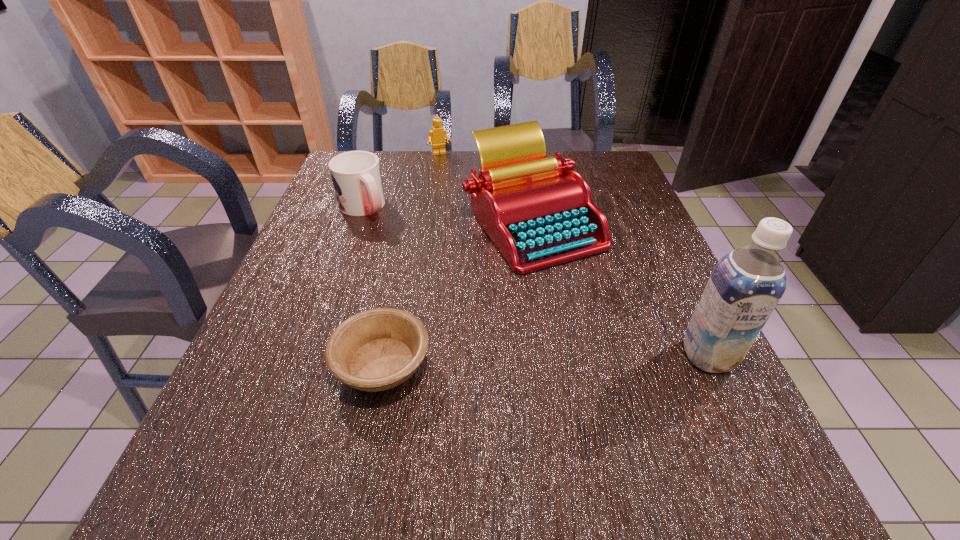
Find the location of a particular element. object situated at the near edge is located at coordinates (378, 349).

Locate an element on the screen. The height and width of the screenshot is (540, 960). object that is positioned at the left edge is located at coordinates [356, 175].

Where is `soya milk that is at the right edge`? soya milk that is at the right edge is located at coordinates (746, 284).

Locate an element on the screen. typewriter located in the right edge section of the desktop is located at coordinates (538, 212).

The width and height of the screenshot is (960, 540). Find the location of `object at the far right corner`. object at the far right corner is located at coordinates pyautogui.click(x=538, y=212).

At what (x,y) coordinates should I click in order to perform the action: click on vacant space at the far edge. Please return your answer as a coordinate pair (x, y). This screenshot has height=540, width=960. Looking at the image, I should click on (435, 163).

You are a GUI agent. You are given a task and a screenshot of the screen. Output one action in this format:
    pyautogui.click(x=<x>, y=<y>)
    Task: Click on the free spot at the near edge of the desktop
    
    Given the screenshot: What is the action you would take?
    pyautogui.click(x=418, y=412)

Identify the location of free space at the left edge of the desktop. The width and height of the screenshot is (960, 540). (335, 249).

The image size is (960, 540). In the image, there is a desktop. Identify the location of vacant space at the right edge. (682, 296).

This screenshot has height=540, width=960. In the image, there is a desktop. In order to click on vacant space at the far left corner in this screenshot , I will do 386,163.